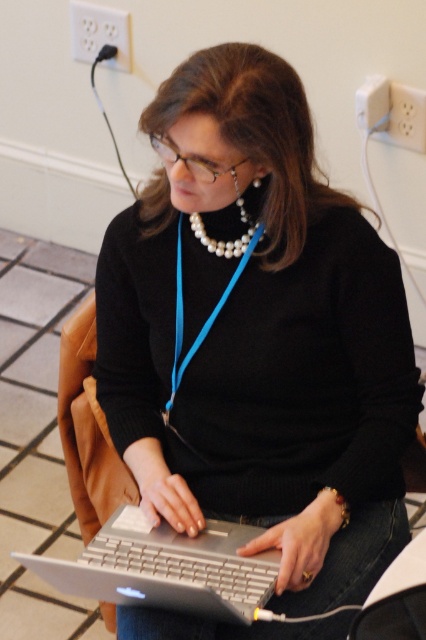
Question: Observing the image, what is the correct spatial positioning of blue fabric lanyard at center in reference to pearl necklace at center?

Choices:
 (A) below
 (B) above

Answer: (A)

Question: Based on their relative distances, which object is nearer to the silver metallic laptop at center?

Choices:
 (A) blue fabric lanyard at center
 (B) pearl necklace at center

Answer: (A)

Question: Which point appears farthest from the camera in this image?

Choices:
 (A) (176, 269)
 (B) (241, 212)

Answer: (A)

Question: Which is farther from the blue fabric lanyard at center?

Choices:
 (A) silver metallic laptop at center
 (B) pearl necklace at center

Answer: (A)

Question: Does silver metallic laptop at center appear on the right side of pearl necklace at center?

Choices:
 (A) no
 (B) yes

Answer: (A)

Question: Is silver metallic laptop at center smaller than blue fabric lanyard at center?

Choices:
 (A) no
 (B) yes

Answer: (A)